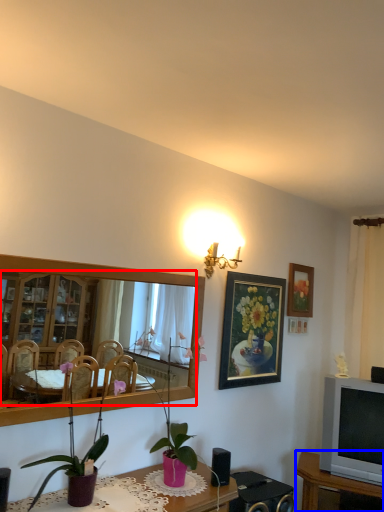
Question: Which of the following is the closest to the observer, mirror (highlighted by a red box) or table (highlighted by a blue box)?

Choices:
 (A) mirror
 (B) table

Answer: (A)